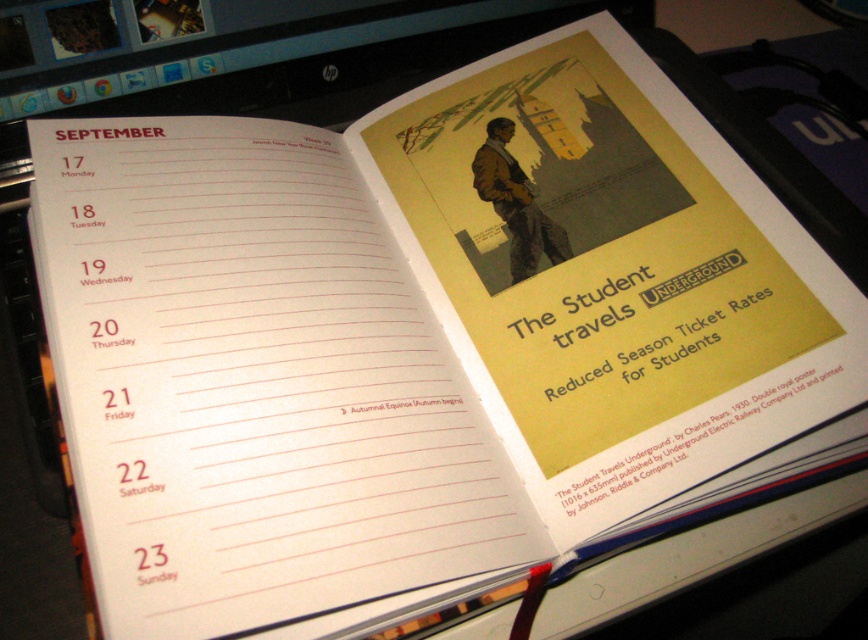
Question: Is yellow paper at upper right to the left of yellow paper poster at upper right from the viewer's perspective?

Choices:
 (A) yes
 (B) no

Answer: (B)

Question: In this image, where is yellow paper at upper right located relative to yellow paper poster at upper right?

Choices:
 (A) right
 (B) left

Answer: (A)

Question: Is yellow paper at upper right below yellow paper poster at upper right?

Choices:
 (A) no
 (B) yes

Answer: (B)